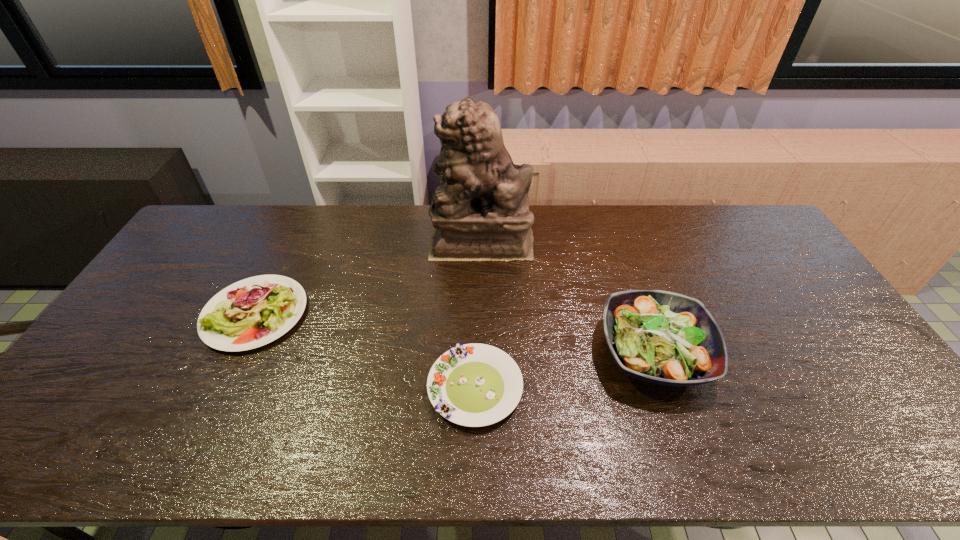
At what (x,y) coordinates should I click in order to perform the action: click on sculpture. Please return your answer as a coordinate pair (x, y). The width and height of the screenshot is (960, 540). Looking at the image, I should click on (481, 212).

Where is `the tallest object`? The height and width of the screenshot is (540, 960). the tallest object is located at coordinates (481, 212).

Find the location of `the rightmost object`. the rightmost object is located at coordinates (660, 337).

Find the location of a particular element. the rightmost salad plate is located at coordinates (660, 337).

Identify the location of the leftmost salad plate. (255, 311).

Identify the location of the second shortest salad plate. (255, 311).

Identify the location of the shortest object. The image size is (960, 540). (474, 385).

Locate an element on the screen. The image size is (960, 540). the shortest salad plate is located at coordinates (474, 385).

The image size is (960, 540). I want to click on vacant area situated 0.250m on the front-facing side of the tallest object, so click(359, 240).

The width and height of the screenshot is (960, 540). Identify the location of vacant region located on the front-facing side of the tallest object. (402, 240).